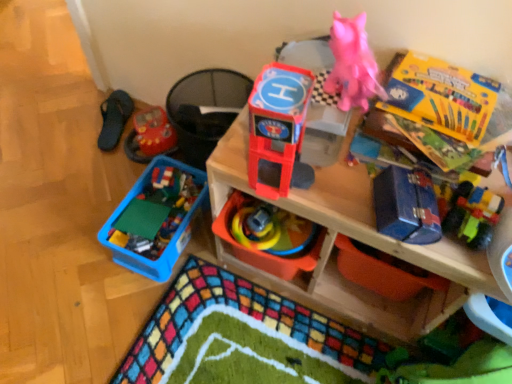
Locate an element on the screen. The image size is (512, 384). free space above rubberized plastic toy at center, placed as the 3th toy when sorted from front to back (from a real-world perspective) is located at coordinates (253, 221).